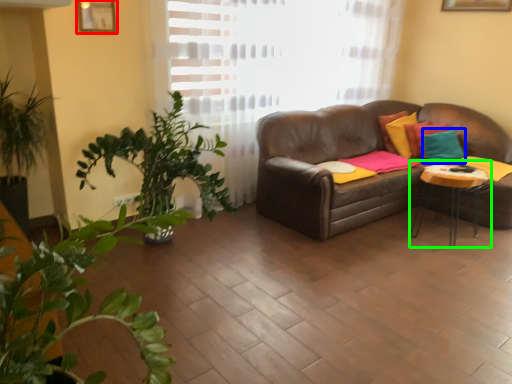
Question: Which is farther away from picture frame (highlighted by a red box)? pillow (highlighted by a blue box) or table (highlighted by a green box)?

Choices:
 (A) pillow
 (B) table

Answer: (A)